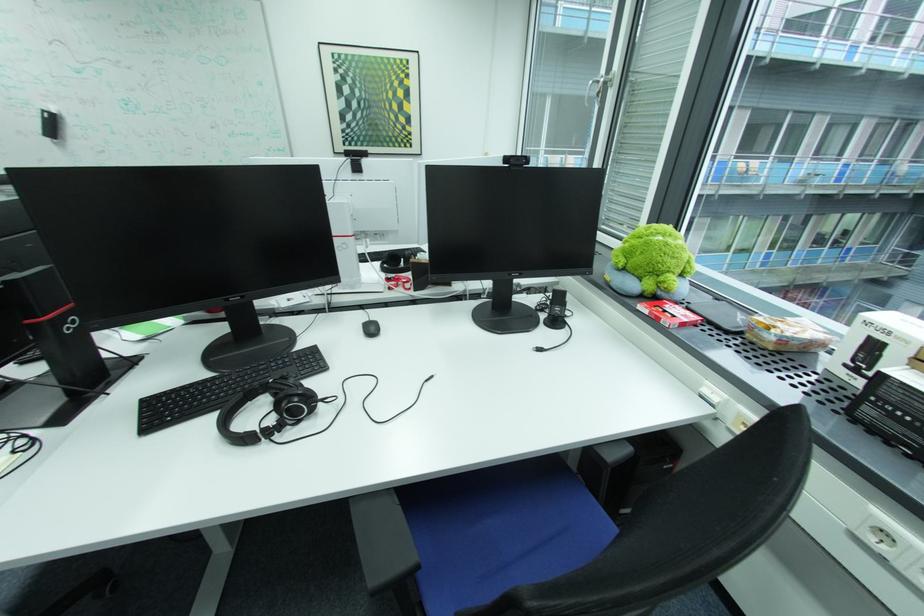
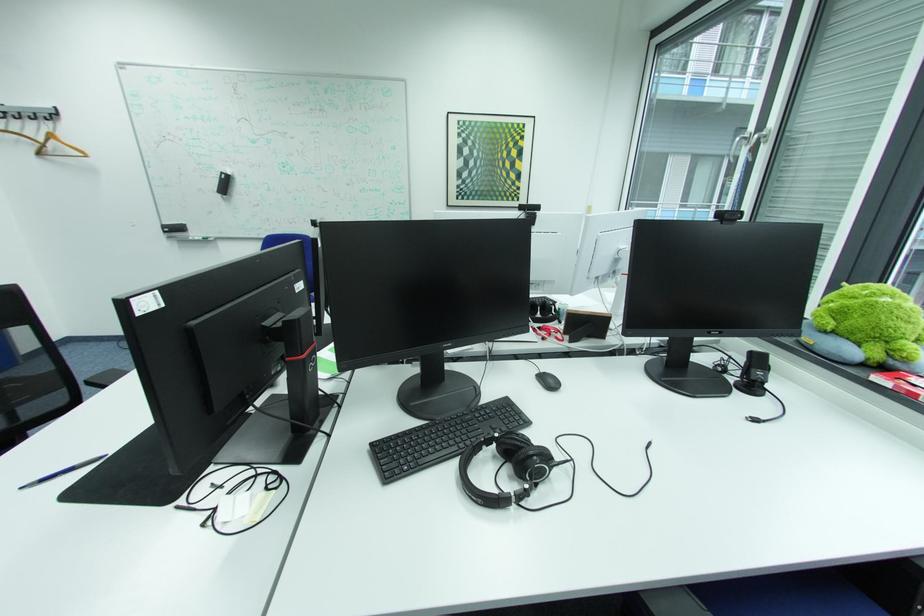
Locate, in the second image, the point that corresponds to the point at 621,87 in the first image.

(773, 143)